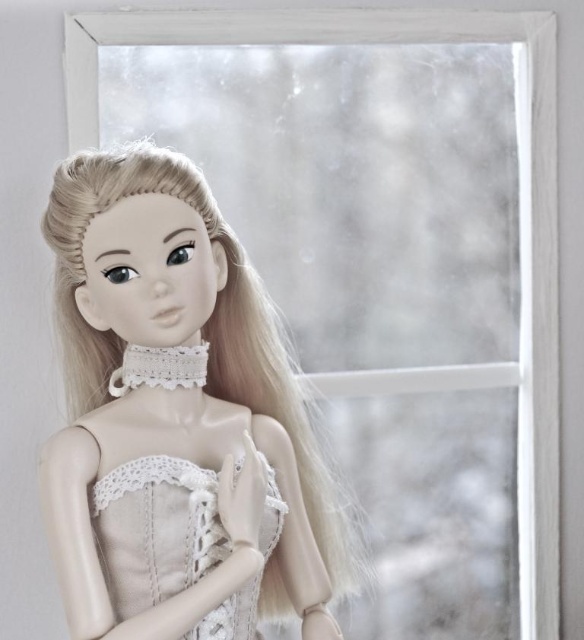
Question: Which of the following is the farthest from the observer?

Choices:
 (A) smooth porcelain doll at center
 (B) satin lace dress at center

Answer: (B)

Question: Which of the following is the farthest from the observer?

Choices:
 (A) satin lace dress at center
 (B) smooth porcelain doll at center

Answer: (A)

Question: Is smooth porcelain doll at center to the left of satin lace dress at center from the viewer's perspective?

Choices:
 (A) no
 (B) yes

Answer: (B)

Question: Is smooth porcelain doll at center positioned before satin lace dress at center?

Choices:
 (A) yes
 (B) no

Answer: (A)

Question: Can you confirm if smooth porcelain doll at center is positioned below satin lace dress at center?

Choices:
 (A) yes
 (B) no

Answer: (B)

Question: Which of the following is the closest to the observer?

Choices:
 (A) satin lace dress at center
 (B) smooth porcelain doll at center

Answer: (B)